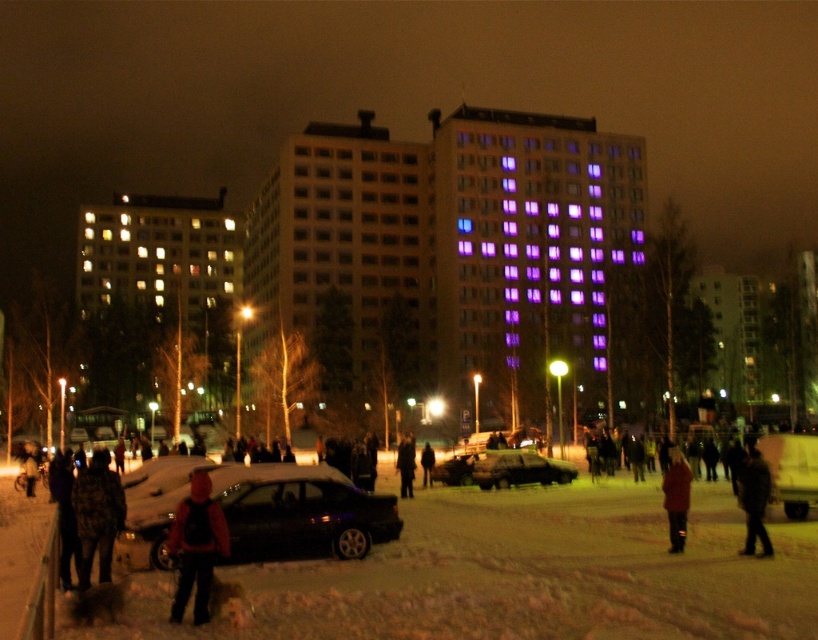
You are standing in the snowy urban scene and want to move from the point at coordinates point [363,522] to the point at coordinates point [758,515]. Which direction should you face to walk towards the second point?

Since point [363,522] is closer to you than point [758,515], you should face upwards to walk towards the second point.

You are a delivery person standing at the edge of the snowy ground. You need to deliver a package to the person wearing the red matte jacket at lower right. The matte black car at center is blocking your path. Can you walk around the car to reach the person?

The red matte jacket at lower right is behind the matte black car at center, so you can walk around the car to reach the person.

You are a delivery person trying to locate the matte red jacket at lower left and the matte black car at center in the snowy scene. Which object is smaller in size?

The matte red jacket at lower left is smaller in size compared to the matte black car at center.